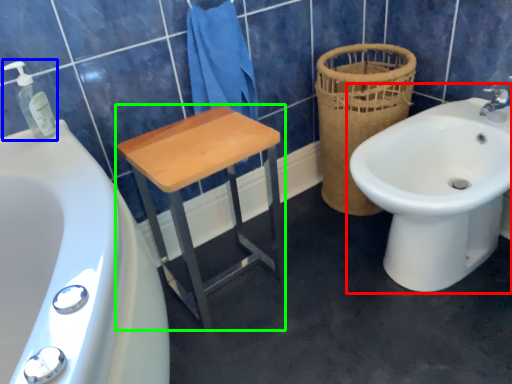
Question: Estimate the real-world distances between objects in this image. Which object is farther from sink (highlighted by a red box), soap dispenser (highlighted by a blue box) or furniture (highlighted by a green box)?

Choices:
 (A) soap dispenser
 (B) furniture

Answer: (A)